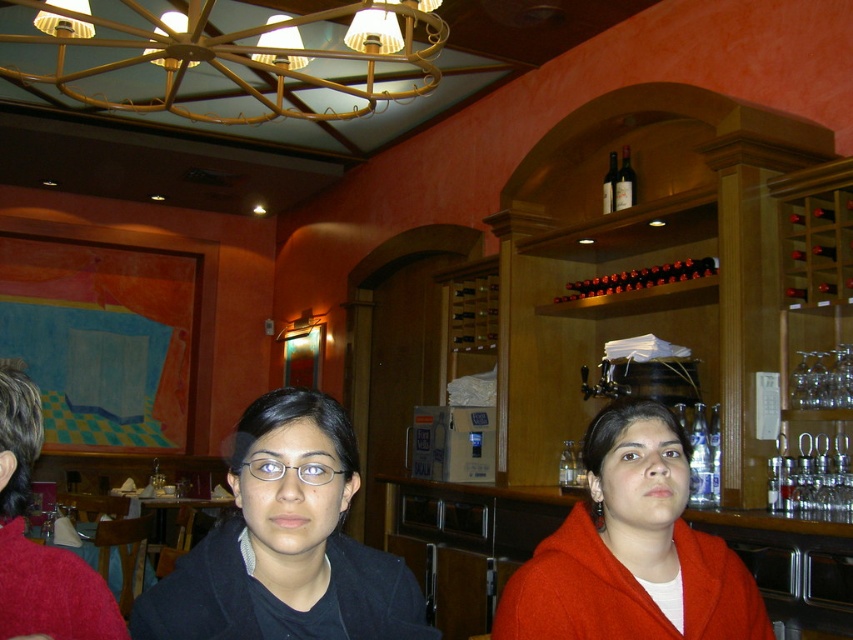
Is black matte jacket at center positioned in front of dark red glass bottle at upper center?

Yes, black matte jacket at center is closer to the viewer.

Does black matte jacket at center appear on the left side of dark red glass bottle at upper center?

Indeed, black matte jacket at center is positioned on the left side of dark red glass bottle at upper center.

Image resolution: width=853 pixels, height=640 pixels. Describe the element at coordinates (285, 547) in the screenshot. I see `black matte jacket at center` at that location.

In order to click on black matte jacket at center in this screenshot , I will do `click(285, 547)`.

Between gold metallic chandelier at upper center and red wool sweater at left, which one has less height?

red wool sweater at left is shorter.

Who is taller, gold metallic chandelier at upper center or red wool sweater at left?

gold metallic chandelier at upper center is taller.

Who is more forward, (242, 44) or (25, 380)?

Positioned in front is point (25, 380).

At what (x,y) coordinates should I click in order to perform the action: click on gold metallic chandelier at upper center. Please return your answer as a coordinate pair (x, y). This screenshot has width=853, height=640. Looking at the image, I should click on (239, 52).

Can you confirm if black matte jacket at center is bigger than red wool sweater at left?

No, black matte jacket at center is not bigger than red wool sweater at left.

Measure the distance between point [242,524] and camera.

Point [242,524] is 1.08 meters from camera.

Is point (248, 541) farther from camera compared to point (6, 588)?

That is True.

What are the coordinates of `black matte jacket at center` in the screenshot? It's located at (285, 547).